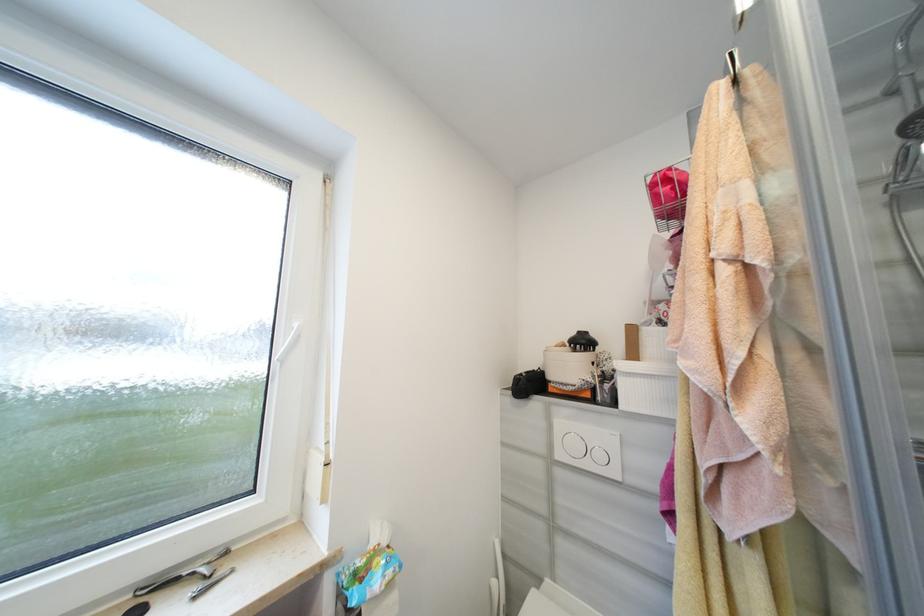
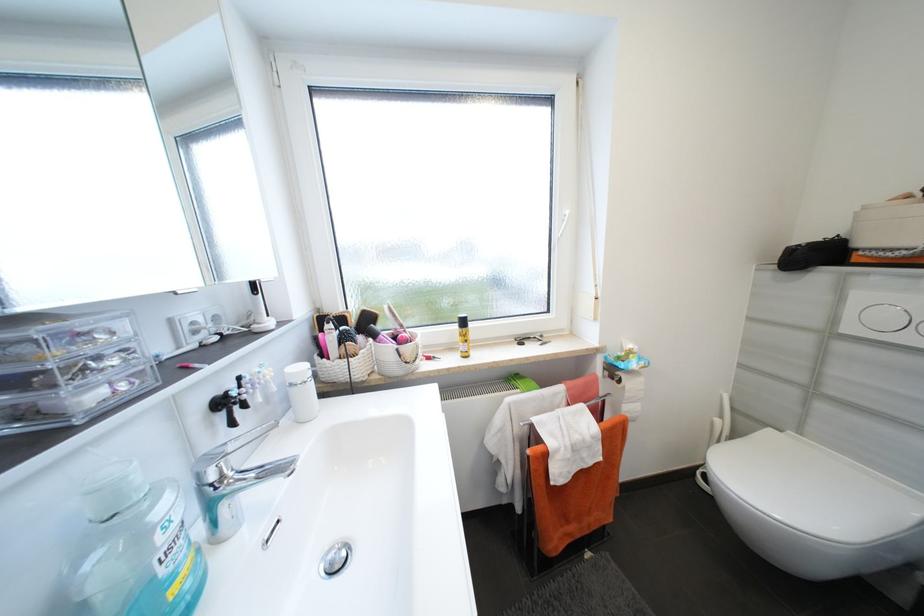
The first image is from the beginning of the video and the second image is from the end. How did the camera likely rotate when shooting the video?

The rotation direction of the camera is left-down.